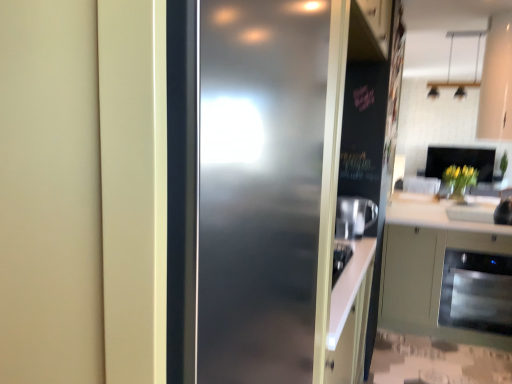
This screenshot has height=384, width=512. What do you see at coordinates (457, 190) in the screenshot?
I see `translucent glass vase at center` at bounding box center [457, 190].

You are a GUI agent. You are given a task and a screenshot of the screen. Output one action in this format:
    pyautogui.click(x=<x>, y=<y>)
    Task: Click on the matte green cabinet at lower right
    
    Given the screenshot: What is the action you would take?
    pyautogui.click(x=429, y=266)

Considering the relative sizes of white glossy sink at lower right and sleek stainless steel dishwasher at lower right in the image provided, is white glossy sink at lower right wider than sleek stainless steel dishwasher at lower right?

No, white glossy sink at lower right is not wider than sleek stainless steel dishwasher at lower right.

In terms of size, does white glossy sink at lower right appear bigger or smaller than sleek stainless steel dishwasher at lower right?

white glossy sink at lower right is smaller than sleek stainless steel dishwasher at lower right.

Would you say white glossy sink at lower right contains sleek stainless steel dishwasher at lower right?

Actually, sleek stainless steel dishwasher at lower right is outside white glossy sink at lower right.

Considering the relative sizes of white glossy sink at lower right and sleek stainless steel dishwasher at lower right in the image provided, is white glossy sink at lower right shorter than sleek stainless steel dishwasher at lower right?

Yes.

From a real-world perspective, is matte white door at center physically below white glossy sink at lower right?

No, from a real-world perspective, matte white door at center is not beneath white glossy sink at lower right.

In terms of width, does matte white door at center look wider or thinner when compared to white glossy sink at lower right?

Clearly, matte white door at center has more width compared to white glossy sink at lower right.

Which is more to the right, matte white door at center or white glossy sink at lower right?

Positioned to the right is white glossy sink at lower right.

Who is smaller, matte green cabinet at lower right or matte white door at center?

With smaller size is matte white door at center.

You are a GUI agent. You are given a task and a screenshot of the screen. Output one action in this format:
    pyautogui.click(x=<x>, y=<y>)
    Task: Click on the door on the left of matte green cabinet at lower right
    This screenshot has height=384, width=512.
    Given the screenshot: What is the action you would take?
    pyautogui.click(x=244, y=188)

From a real-world perspective, is matte green cabinet at lower right above or below matte white door at center?

Clearly, from a real-world perspective, matte green cabinet at lower right is below matte white door at center.

Between matte green cabinet at lower right and matte white door at center, which one has smaller width?

matte white door at center.

Is sleek stainless steel dishwasher at lower right far from matte white door at center?

sleek stainless steel dishwasher at lower right is positioned a significant distance from matte white door at center.

The image size is (512, 384). Find the location of `dish washer that is under the matte white door at center (from a real-world perspective)`. dish washer that is under the matte white door at center (from a real-world perspective) is located at coordinates (477, 292).

From a real-world perspective, is sleek stainless steel dishwasher at lower right located beneath matte white door at center?

Correct, in the physical world, sleek stainless steel dishwasher at lower right is lower than matte white door at center.

Can you confirm if sleek stainless steel dishwasher at lower right is thinner than matte white door at center?

In fact, sleek stainless steel dishwasher at lower right might be wider than matte white door at center.

Consider the image. Does sleek stainless steel dishwasher at lower right turn towards translucent glass vase at center?

No.

Which of these two, sleek stainless steel dishwasher at lower right or translucent glass vase at center, is bigger?

Bigger between the two is sleek stainless steel dishwasher at lower right.

Does sleek stainless steel dishwasher at lower right have a greater height compared to translucent glass vase at center?

Correct, sleek stainless steel dishwasher at lower right is much taller as translucent glass vase at center.

From the image's perspective, relative to translucent glass vase at center, is sleek stainless steel dishwasher at lower right above or below?

Clearly, from the image's perspective, sleek stainless steel dishwasher at lower right is below translucent glass vase at center.

Is translucent glass vase at center inside or outside of sleek stainless steel dishwasher at lower right?

translucent glass vase at center exists outside the volume of sleek stainless steel dishwasher at lower right.

How many degrees apart are the facing directions of translucent glass vase at center and sleek stainless steel dishwasher at lower right?

There is a 0.682-degree angle between the facing directions of translucent glass vase at center and sleek stainless steel dishwasher at lower right.

Considering the positions of objects translucent glass vase at center and sleek stainless steel dishwasher at lower right in the image provided, who is more to the right, translucent glass vase at center or sleek stainless steel dishwasher at lower right?

translucent glass vase at center is more to the right.

Is translucent glass vase at center smaller than sleek stainless steel dishwasher at lower right?

Yes.

Relative to sleek stainless steel dishwasher at lower right, is matte white door at center in front or behind?

matte white door at center is in front of sleek stainless steel dishwasher at lower right.

From the image's perspective, is matte white door at center on top of sleek stainless steel dishwasher at lower right?

Yes, from the image's perspective, matte white door at center is over sleek stainless steel dishwasher at lower right.

Between matte white door at center and sleek stainless steel dishwasher at lower right, which one appears on the right side from the viewer's perspective?

From the viewer's perspective, sleek stainless steel dishwasher at lower right appears more on the right side.

At what (x,y) coordinates should I click in order to perform the action: click on dish washer that appears below the white glossy sink at lower right (from the image's perspective). Please return your answer as a coordinate pair (x, y). The width and height of the screenshot is (512, 384). Looking at the image, I should click on (477, 292).

Locate an element on the screen. The image size is (512, 384). door that appears on the left of white glossy sink at lower right is located at coordinates (244, 188).

When comparing their distances from matte green cabinet at lower right, does matte white door at center or translucent glass vase at center seem closer?

matte white door at center is positioned closer to the anchor matte green cabinet at lower right.

Which object lies further to the anchor point white glossy sink at lower right, translucent glass vase at center or sleek stainless steel dishwasher at lower right?

The object further to white glossy sink at lower right is sleek stainless steel dishwasher at lower right.

Looking at the image, which one is located further to translucent glass vase at center, matte green cabinet at lower right or yellow matte vase at right?

Among the two, matte green cabinet at lower right is located further to translucent glass vase at center.

Which object lies nearer to the anchor point matte green cabinet at lower right, white glossy sink at lower right or matte white door at center?

Based on the image, white glossy sink at lower right appears to be nearer to matte green cabinet at lower right.

Which object lies nearer to the anchor point matte green cabinet at lower right, yellow matte vase at right or translucent glass vase at center?

Among the two, translucent glass vase at center is located nearer to matte green cabinet at lower right.

Estimate the real-world distances between objects in this image. Which object is further from translucent glass vase at center, matte white door at center or sleek stainless steel dishwasher at lower right?

matte white door at center.

Which object lies nearer to the anchor point matte white door at center, white glossy sink at lower right or sleek stainless steel dishwasher at lower right?

sleek stainless steel dishwasher at lower right lies closer to matte white door at center than the other object.

From the image, which object appears to be nearer to sleek stainless steel dishwasher at lower right, matte white door at center or matte green cabinet at lower right?

The object closer to sleek stainless steel dishwasher at lower right is matte green cabinet at lower right.

What are the coordinates of `sink between sleek stainless steel dishwasher at lower right and translucent glass vase at center along the z-axis` in the screenshot? It's located at (482, 212).

This screenshot has height=384, width=512. I want to click on dish washer between matte green cabinet at lower right and translucent glass vase at center along the z-axis, so click(477, 292).

At what (x,y) coordinates should I click in order to perform the action: click on dish washer positioned between matte white door at center and white glossy sink at lower right from near to far. Please return your answer as a coordinate pair (x, y). Looking at the image, I should click on (477, 292).

You are a GUI agent. You are given a task and a screenshot of the screen. Output one action in this format:
    pyautogui.click(x=<x>, y=<y>)
    Task: Click on the cabinetry between white glossy sink at lower right and sleek stainless steel dishwasher at lower right in the up-down direction
    
    Given the screenshot: What is the action you would take?
    pyautogui.click(x=429, y=266)